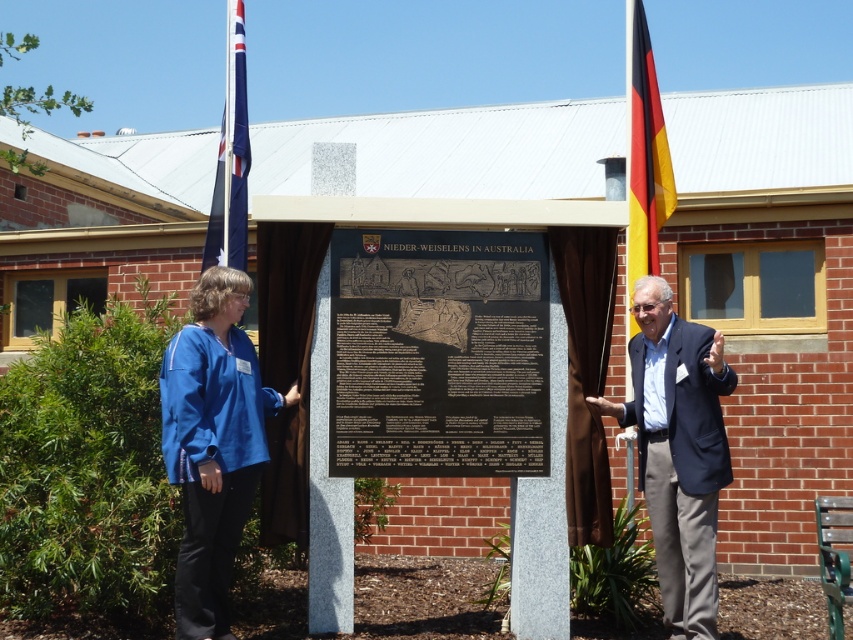
Between point (183, 458) and point (206, 243), which one is positioned behind?

Point (206, 243)

Who is more forward, (204,390) or (241,10)?

Positioned in front is point (204,390).

I want to click on blue fabric shirt at left, so click(x=213, y=444).

Describe the element at coordinates (643, 152) in the screenshot. This screenshot has width=853, height=640. I see `yellow and black striped flag at right` at that location.

Can you confirm if yellow and black striped flag at right is smaller than blue fabric flag at upper left?

No, yellow and black striped flag at right is not smaller than blue fabric flag at upper left.

Between point (660, 102) and point (234, 99), which one is positioned behind?

Positioned behind is point (660, 102).

The width and height of the screenshot is (853, 640). In order to click on yellow and black striped flag at right in this screenshot , I will do `click(643, 152)`.

Between blue fabric shirt at left and dark blue suit at right, which one has less height?

blue fabric shirt at left is shorter.

Describe the element at coordinates (213, 444) in the screenshot. The image size is (853, 640). I see `blue fabric shirt at left` at that location.

Between point (247, 400) and point (700, 596), which one is positioned behind?

The point (700, 596) is more distant.

Locate an element on the screen. The image size is (853, 640). blue fabric shirt at left is located at coordinates (213, 444).